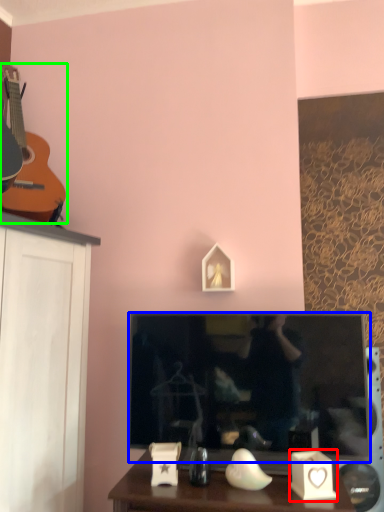
Question: Considering the real-world distances, which object is closest to candle holder (highlighted by a red box)? television (highlighted by a blue box) or guitar (highlighted by a green box).

Choices:
 (A) television
 (B) guitar

Answer: (A)